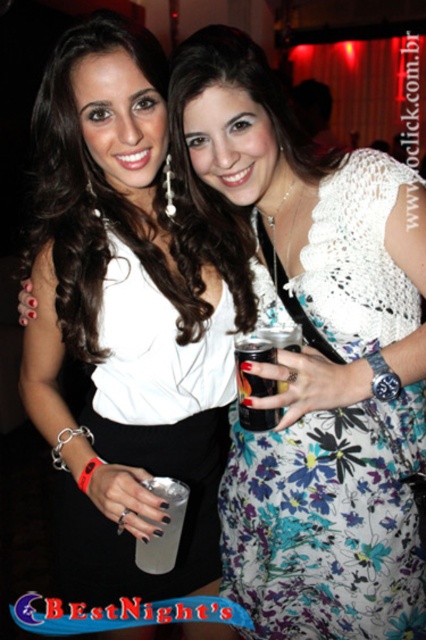
Where is the white matte dress at center located in the image?

The white matte dress at center is located at point 0.494 on the x axis and 0.300 on the y axis.